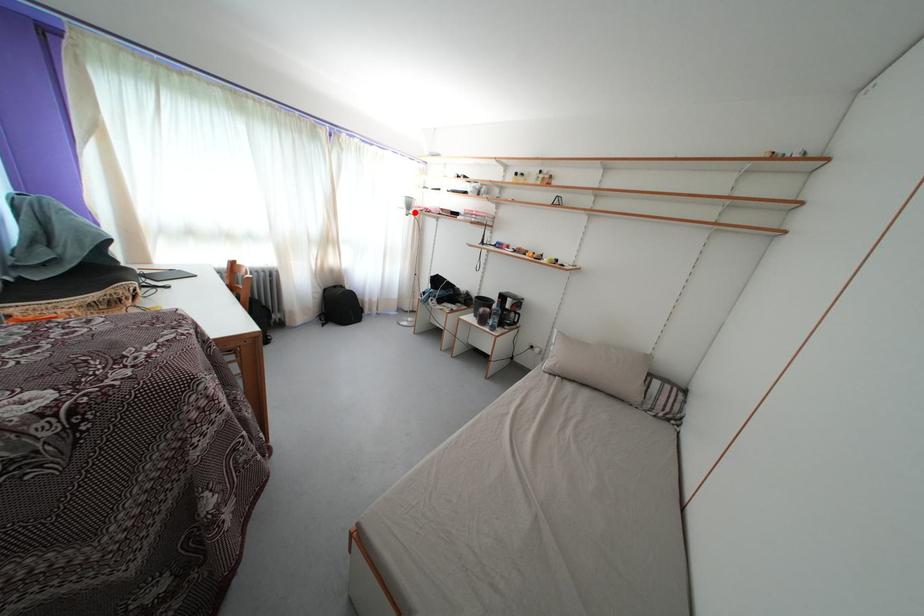
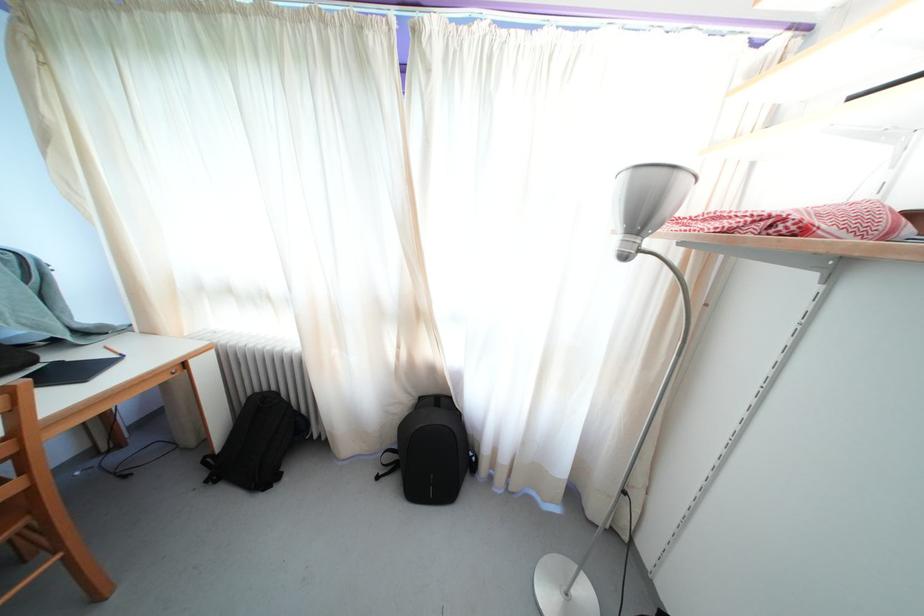
The point at the highlighted location is marked in the first image. Where is the corresponding point in the second image?

(648, 223)